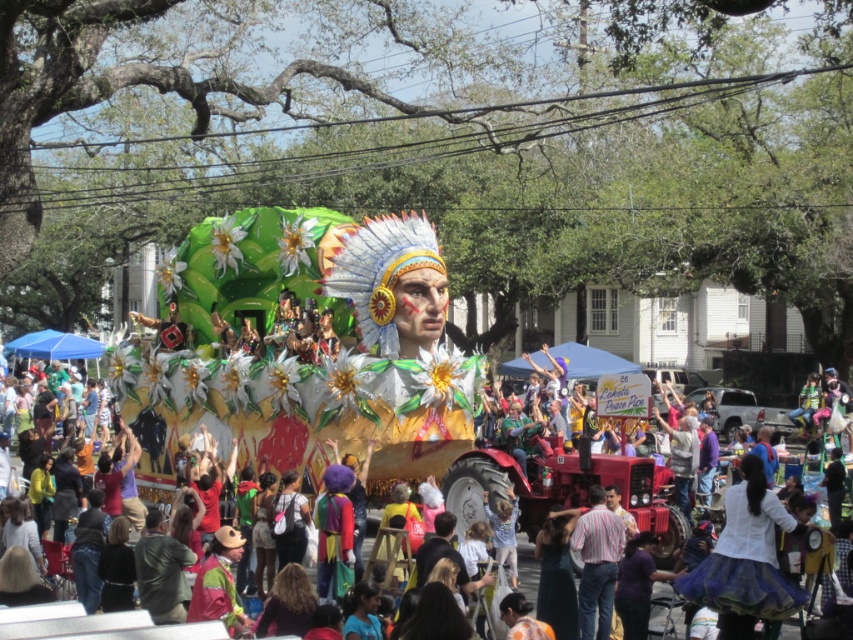
Question: Which is nearer to the blue sequined skirt at lower right?

Choices:
 (A) golden metallic float at center
 (B) striped cotton shirt at center

Answer: (B)

Question: Which point is farther to the camera?

Choices:
 (A) (711, 556)
 (B) (407, 243)
 (C) (604, 616)

Answer: (B)

Question: Does golden metallic float at center have a greater width compared to striped cotton shirt at center?

Choices:
 (A) no
 (B) yes

Answer: (B)

Question: Which object is farther from the camera taking this photo?

Choices:
 (A) striped cotton shirt at center
 (B) golden metallic float at center

Answer: (B)

Question: Is golden metallic float at center to the right of striped cotton shirt at center from the viewer's perspective?

Choices:
 (A) yes
 (B) no

Answer: (B)

Question: Can you confirm if golden metallic float at center is thinner than blue sequined skirt at lower right?

Choices:
 (A) yes
 (B) no

Answer: (B)